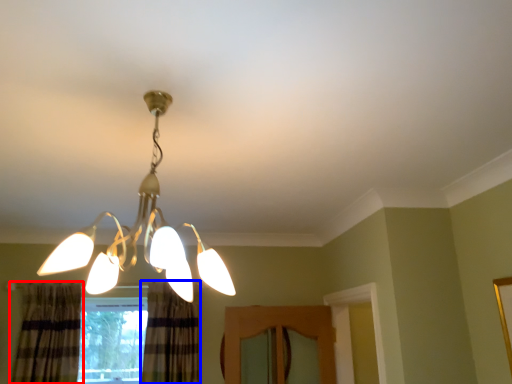
Question: Which object is closer to the camera taking this photo, curtain (highlighted by a red box) or curtain (highlighted by a blue box)?

Choices:
 (A) curtain
 (B) curtain

Answer: (A)